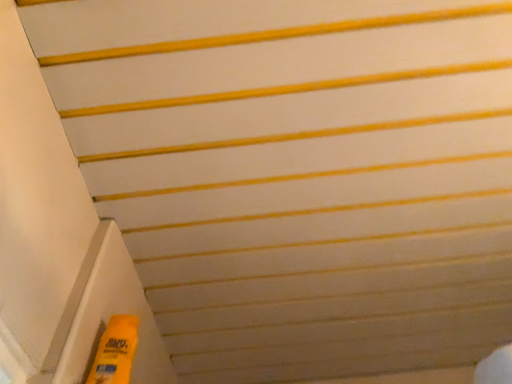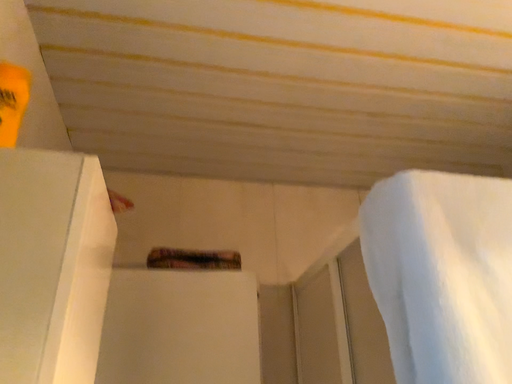
Question: Which way did the camera rotate in the video?

Choices:
 (A) rotated downward
 (B) rotated upward

Answer: (A)